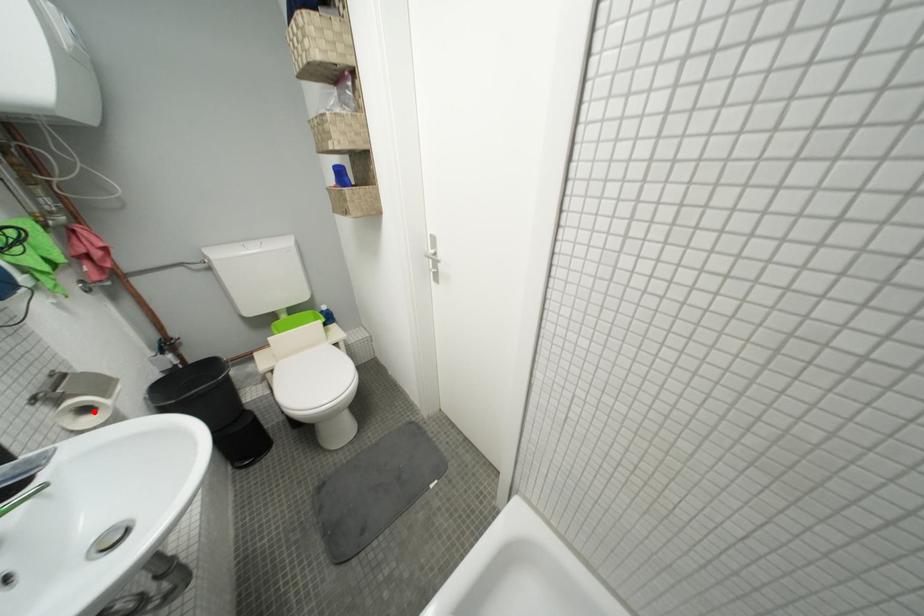
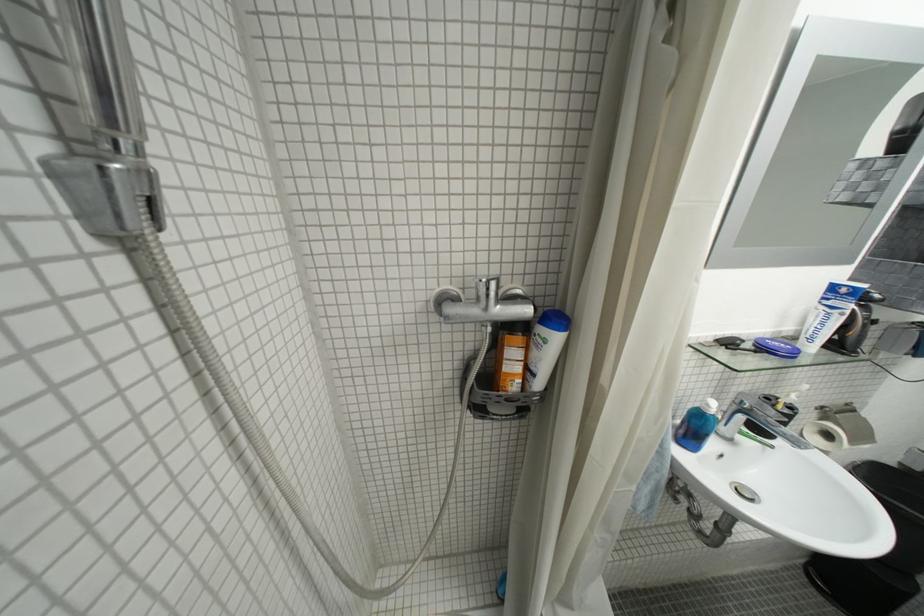
Question: I am providing you with two images of the same scene from different viewpoints. A red point is marked on the first image. Is the red point's position out of view in image 2?

Choices:
 (A) Yes
 (B) No

Answer: (B)